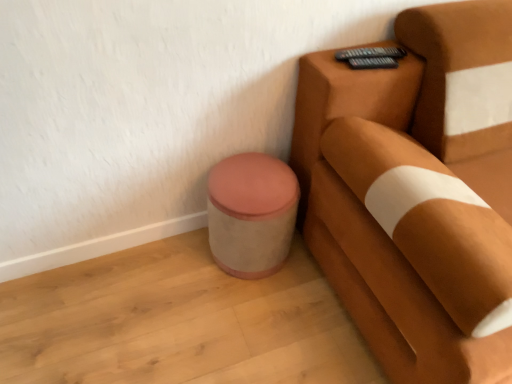
Question: Based on their positions, is pink fabric ottoman at lower left located to the left or right of suede brown armchair at right?

Choices:
 (A) right
 (B) left

Answer: (B)

Question: Is point (245, 218) positioned closer to the camera than point (353, 195)?

Choices:
 (A) farther
 (B) closer

Answer: (A)

Question: From the image's perspective, is pink fabric ottoman at lower left positioned above or below suede brown armchair at right?

Choices:
 (A) below
 (B) above

Answer: (A)

Question: Is point (436, 324) closer or farther from the camera than point (274, 233)?

Choices:
 (A) farther
 (B) closer

Answer: (B)

Question: Is suede brown armchair at right to the left or to the right of pink fabric ottoman at lower left in the image?

Choices:
 (A) left
 (B) right

Answer: (B)

Question: From their relative heights in the image, would you say suede brown armchair at right is taller or shorter than pink fabric ottoman at lower left?

Choices:
 (A) short
 (B) tall

Answer: (B)

Question: From the image's perspective, relative to pink fabric ottoman at lower left, is suede brown armchair at right above or below?

Choices:
 (A) above
 (B) below

Answer: (A)